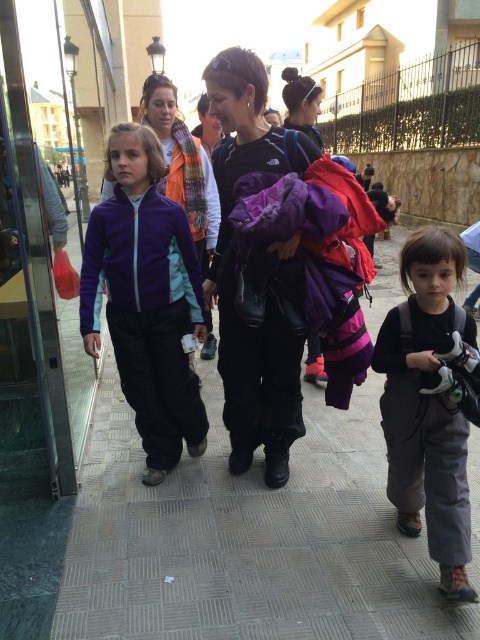
Question: Does gray tile pavement at center appear over purple fleece jacket at center?

Choices:
 (A) no
 (B) yes

Answer: (A)

Question: Which of the following is the closest to the observer?

Choices:
 (A) purple fleece jacket at center
 (B) purple fleece jacket at left
 (C) matte black jacket at center

Answer: (C)

Question: Can you confirm if gray tile pavement at center is bigger than matte black jacket at center?

Choices:
 (A) no
 (B) yes

Answer: (B)

Question: Which object is positioned farthest from the gray fabric backpack at lower right?

Choices:
 (A) purple fleece jacket at left
 (B) gray tile pavement at center
 (C) purple fleece jacket at center

Answer: (C)

Question: Is purple fleece jacket at left to the left of matte black jacket at center from the viewer's perspective?

Choices:
 (A) no
 (B) yes

Answer: (B)

Question: Which point is farther to the camera?

Choices:
 (A) purple fleece jacket at center
 (B) gray fabric backpack at lower right

Answer: (A)